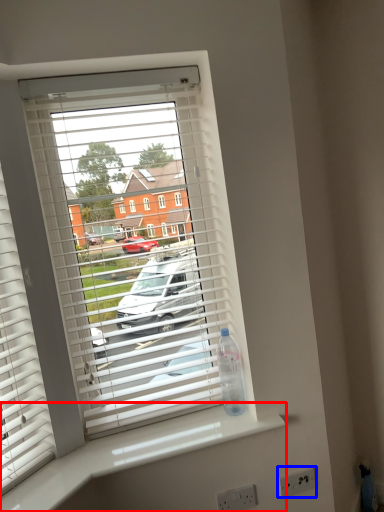
Question: Which object is further to the camera taking this photo, counter top (highlighted by a red box) or electric outlet (highlighted by a blue box)?

Choices:
 (A) counter top
 (B) electric outlet

Answer: (B)